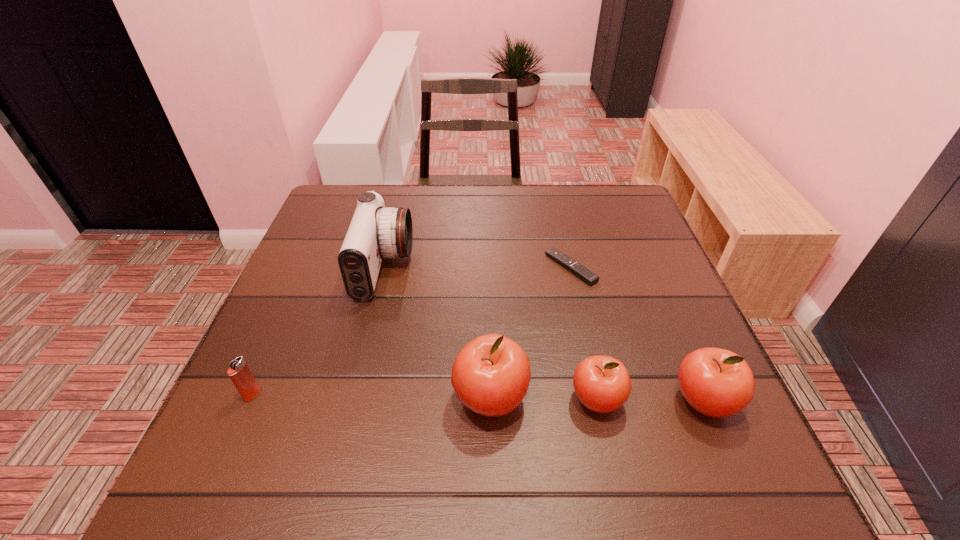
Locate an element on the screen. The image size is (960, 540). free space located on the back of the shortest apple is located at coordinates (571, 287).

The height and width of the screenshot is (540, 960). What are the coordinates of `vacant position located on the back of the rightmost object` in the screenshot? It's located at (673, 331).

What are the coordinates of `free region located on the surface of the fifth object from right to left` in the screenshot? It's located at (459, 268).

This screenshot has width=960, height=540. I want to click on vacant space located 0.140m on the back of the igniter, so click(x=280, y=330).

Where is `free spot located on the left of the shortest object`? The image size is (960, 540). free spot located on the left of the shortest object is located at coordinates (465, 267).

The image size is (960, 540). What are the coordinates of `igniter positioned at the near edge` in the screenshot? It's located at (239, 372).

You are a GUI agent. You are given a task and a screenshot of the screen. Output one action in this format:
    pyautogui.click(x=<x>, y=<y>)
    Task: Click on the camcorder present at the left edge
    The height and width of the screenshot is (540, 960).
    Given the screenshot: What is the action you would take?
    point(376,231)

Find the location of a particular element. This screenshot has width=960, height=540. igniter that is positioned at the left edge is located at coordinates (239, 372).

This screenshot has height=540, width=960. In order to click on object that is at the right edge in this screenshot , I will do pyautogui.click(x=716, y=382).

Locate an element on the screen. The width and height of the screenshot is (960, 540). object that is positioned at the near left corner is located at coordinates (239, 372).